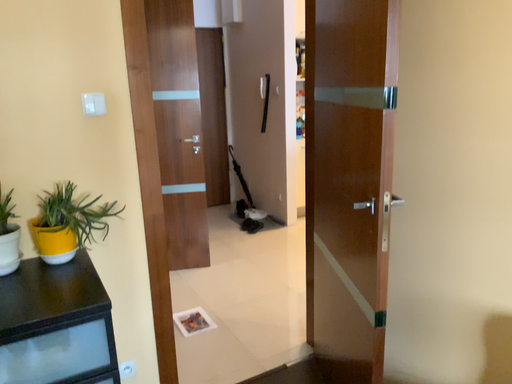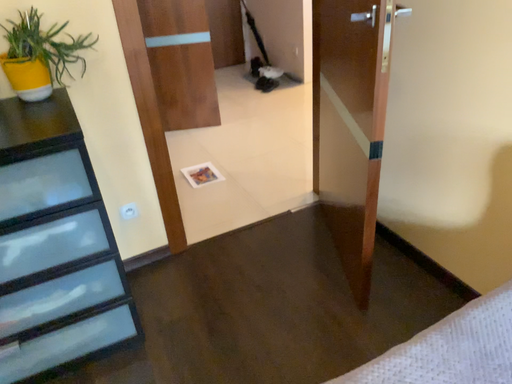
Question: Which way did the camera rotate in the video?

Choices:
 (A) rotated upward
 (B) rotated downward

Answer: (B)